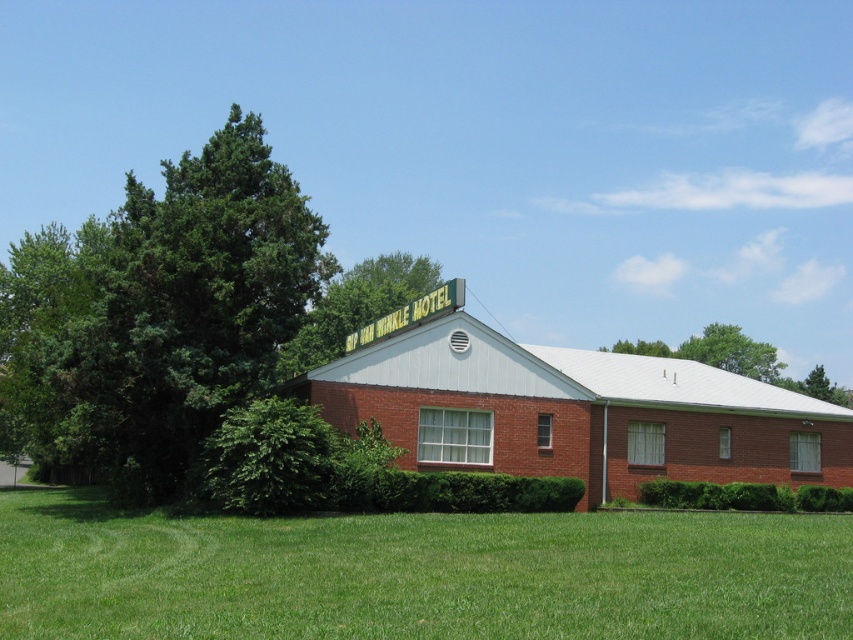
Question: Which of these objects is positioned closest to the green leafy tree at upper center?

Choices:
 (A) green grass at lower center
 (B) green leafy tree at left

Answer: (B)

Question: Which of the following is the closest to the observer?

Choices:
 (A) green leafy tree at upper center
 (B) green grass at lower center
 (C) green leafy tree at upper right
 (D) green leafy bush at lower left

Answer: (B)

Question: Can you confirm if green leafy tree at upper center is bigger than green leafy tree at upper right?

Choices:
 (A) yes
 (B) no

Answer: (B)

Question: Based on their relative distances, which object is nearer to the green leafy tree at left?

Choices:
 (A) green leafy bush at lower left
 (B) green leafy tree at upper center
 (C) green grass at lower center
 (D) green leafy tree at upper right

Answer: (A)

Question: Does green leafy tree at left appear over green leafy bush at lower left?

Choices:
 (A) yes
 (B) no

Answer: (A)

Question: Is the position of green grass at lower center more distant than that of green leafy bush at lower left?

Choices:
 (A) yes
 (B) no

Answer: (B)